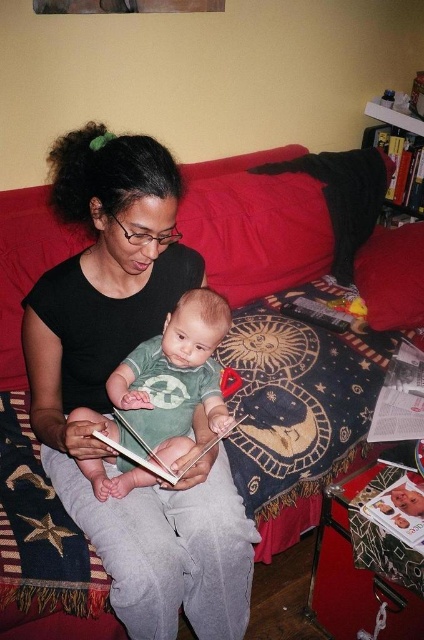
You are a photographer trying to capture the perfect shot of the scene. You notice two points in the image at coordinates point (x=390, y=426) and point (x=413, y=492). Which point is closer to your camera lens?

Point (x=390, y=426) is further to the viewer than point (x=413, y=492), so the closer point to the camera lens would be point (x=390, y=426).

You are a tailor who needs to determine if the green cotton shirt at center can fit into a storage box designed for items no wider than the matte paper book at lower right. Based on the scene description, can the shirt fit?

The green cotton shirt at center has a width larger than the matte paper book at lower right, so it cannot fit into the storage box designed for items no wider than the matte paper book at lower right.